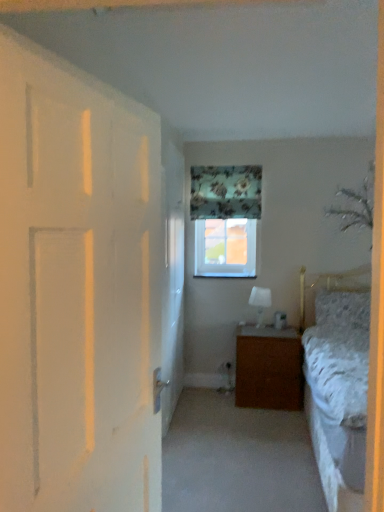
I want to click on free point above brown wooden nightstand at center (from a real-world perspective), so click(260, 325).